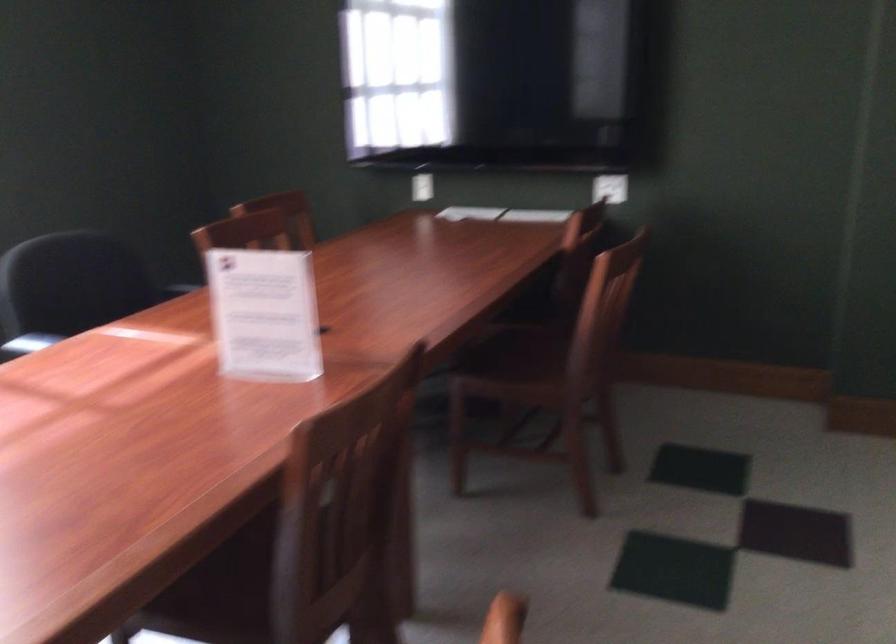
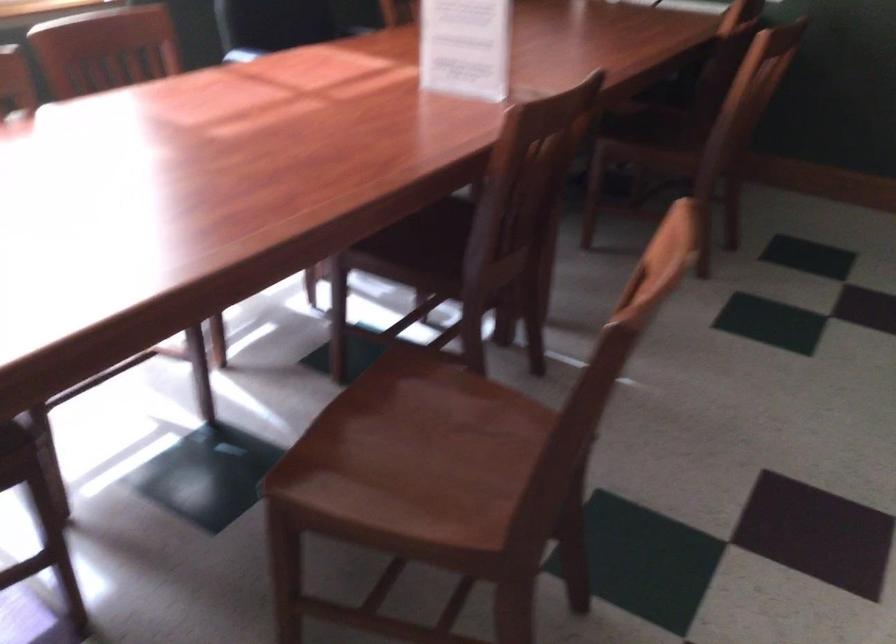
Question: How did the camera likely rotate?

Choices:
 (A) Left
 (B) Right
 (C) Up
 (D) Down

Answer: (D)